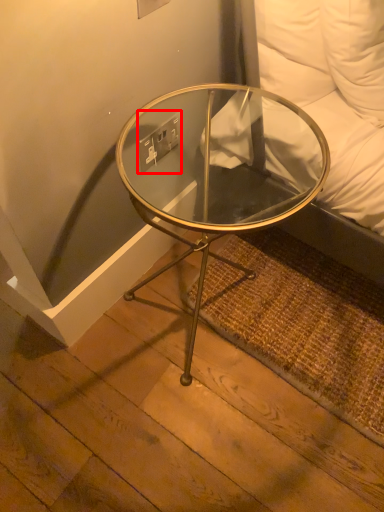
Question: From the image's perspective, where is electric outlet (annotated by the red box) located relative to coffee table?

Choices:
 (A) above
 (B) below

Answer: (A)